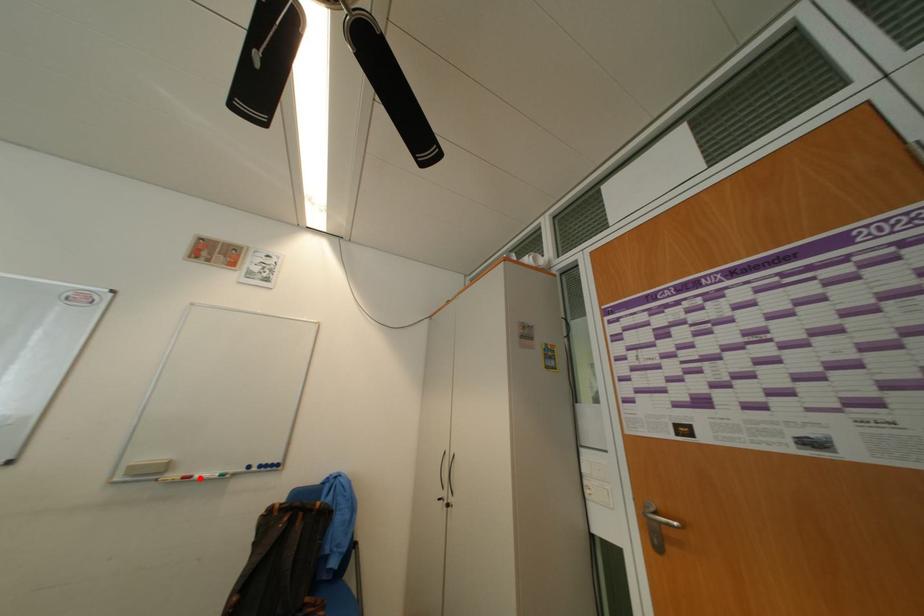
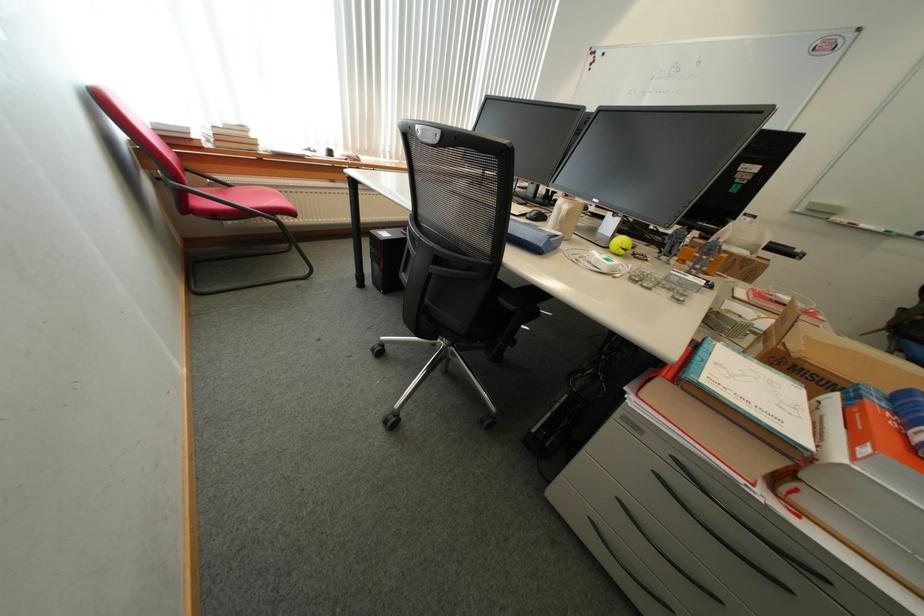
Question: I am providing you with two images of the same scene from different viewpoints. A red point is marked on the first image. At the location where the point appears in image 1, is it still visible in image 2?

Choices:
 (A) Yes
 (B) No

Answer: (A)